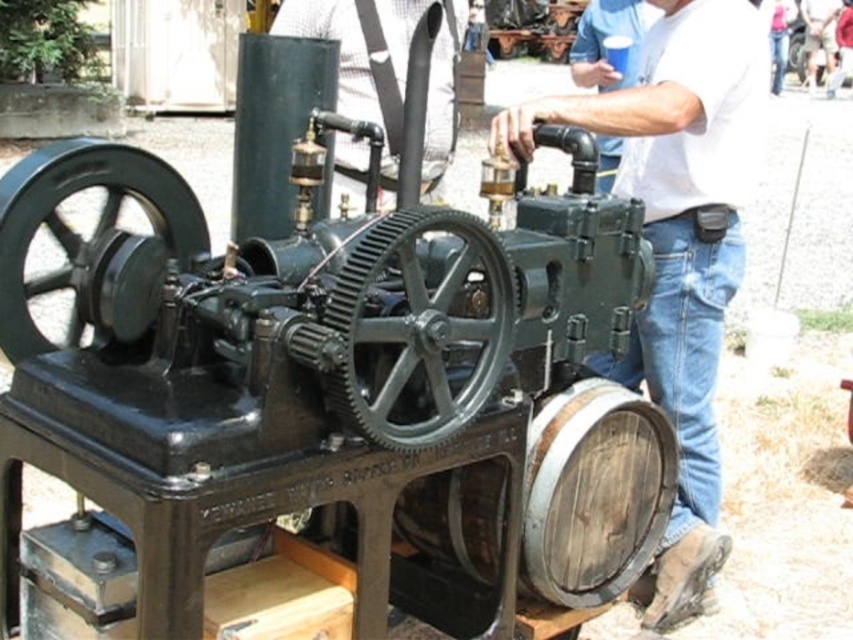
Does white matte shirt at upper center come in front of matte black tank at center?

Yes, it is.

This screenshot has height=640, width=853. What do you see at coordinates (679, 244) in the screenshot?
I see `white matte shirt at upper center` at bounding box center [679, 244].

Which is behind, point (712, 609) or point (376, 12)?

Positioned behind is point (376, 12).

This screenshot has width=853, height=640. What are the coordinates of `white matte shirt at upper center` in the screenshot? It's located at (679, 244).

Does black cast iron steam engine at center appear on the right side of matte black tank at center?

Correct, you'll find black cast iron steam engine at center to the right of matte black tank at center.

Does black cast iron steam engine at center have a greater height compared to matte black tank at center?

Correct, black cast iron steam engine at center is much taller as matte black tank at center.

You are a GUI agent. You are given a task and a screenshot of the screen. Output one action in this format:
    pyautogui.click(x=<x>, y=<y>)
    Task: Click on the black cast iron steam engine at center
    The image size is (853, 640).
    Given the screenshot: What is the action you would take?
    pyautogui.click(x=322, y=406)

Identify the location of black cast iron steam engine at center. (322, 406).

I want to click on matte black tank at center, so click(x=363, y=54).

Is point (387, 32) farther from camera compared to point (612, 12)?

No, (387, 32) is closer to viewer.

Image resolution: width=853 pixels, height=640 pixels. What are the coordinates of `matte black tank at center` in the screenshot? It's located at (363, 54).